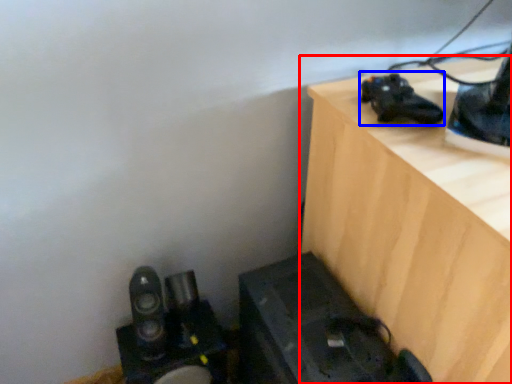
Question: Which object appears farthest to the camera in this image, furniture (highlighted by a red box) or shoe (highlighted by a blue box)?

Choices:
 (A) furniture
 (B) shoe

Answer: (B)